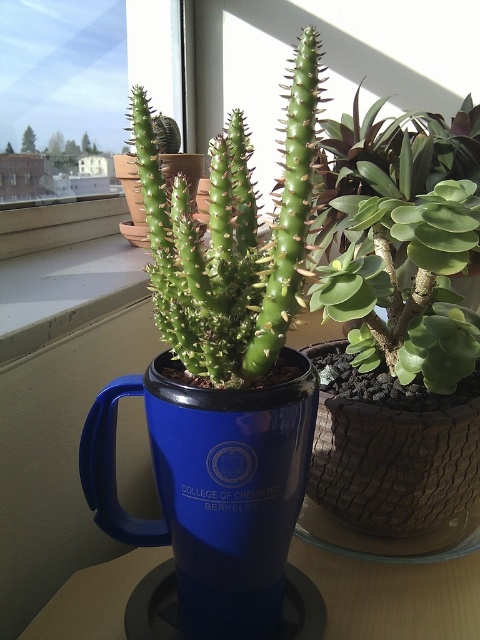
Is blue ceramic mug at center to the left of blue plastic table at center from the viewer's perspective?

Indeed, blue ceramic mug at center is positioned on the left side of blue plastic table at center.

Does blue ceramic mug at center have a smaller size compared to blue plastic table at center?

No.

In order to click on blue ceramic mug at center in this screenshot , I will do `click(214, 500)`.

Is blue ceramic mug at center closer to the viewer compared to green succulent at center?

Yes.

Is point (179, 538) in front of point (339, 273)?

Yes, it is.

I want to click on blue ceramic mug at center, so click(214, 500).

Is blue ceramic mug at center thinner than transparent glass window at upper center?

Yes, blue ceramic mug at center is thinner than transparent glass window at upper center.

Between blue ceramic mug at center and transparent glass window at upper center, which one appears on the right side from the viewer's perspective?

Positioned to the right is blue ceramic mug at center.

Is point (266, 616) farther from viewer compared to point (71, 240)?

That is False.

Find the location of `blue ceramic mug at center`. blue ceramic mug at center is located at coordinates (214, 500).